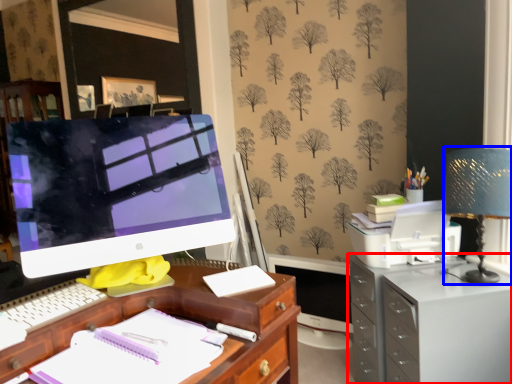
Question: Among these objects, which one is nearest to the camera, filing cabinet (highlighted by a red box) or table lamp (highlighted by a blue box)?

Choices:
 (A) filing cabinet
 (B) table lamp

Answer: (B)